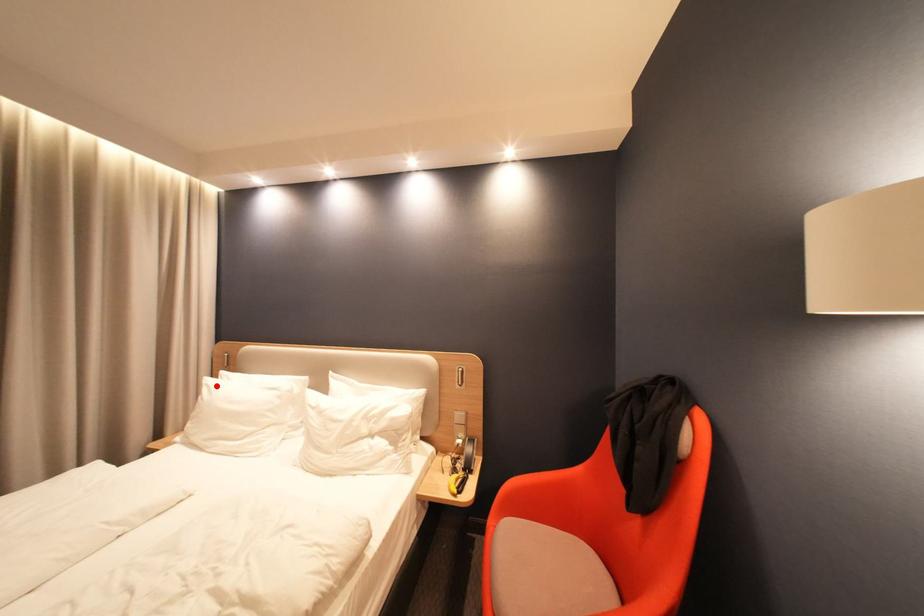
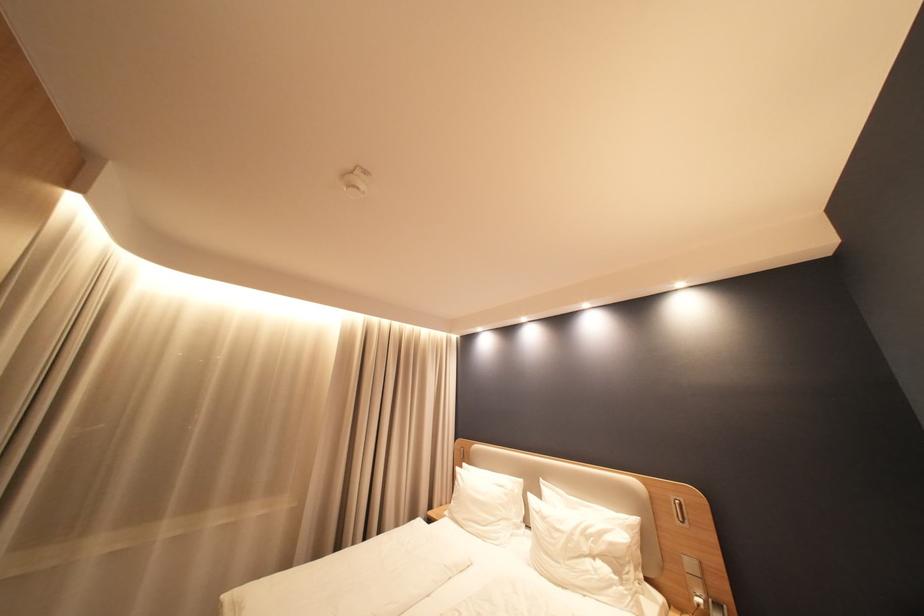
Locate, in the second image, the point that corresponds to the highlighted location in the first image.

(468, 475)